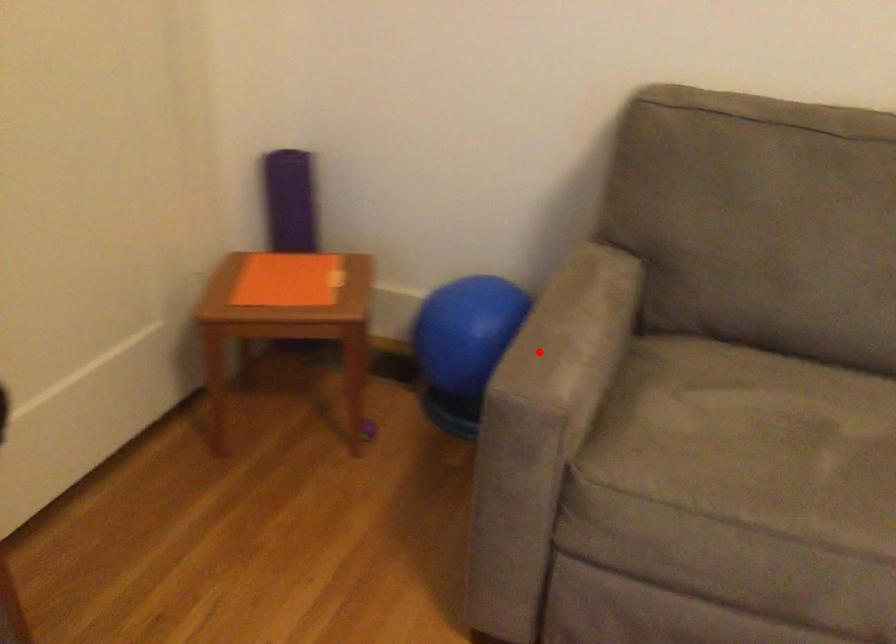
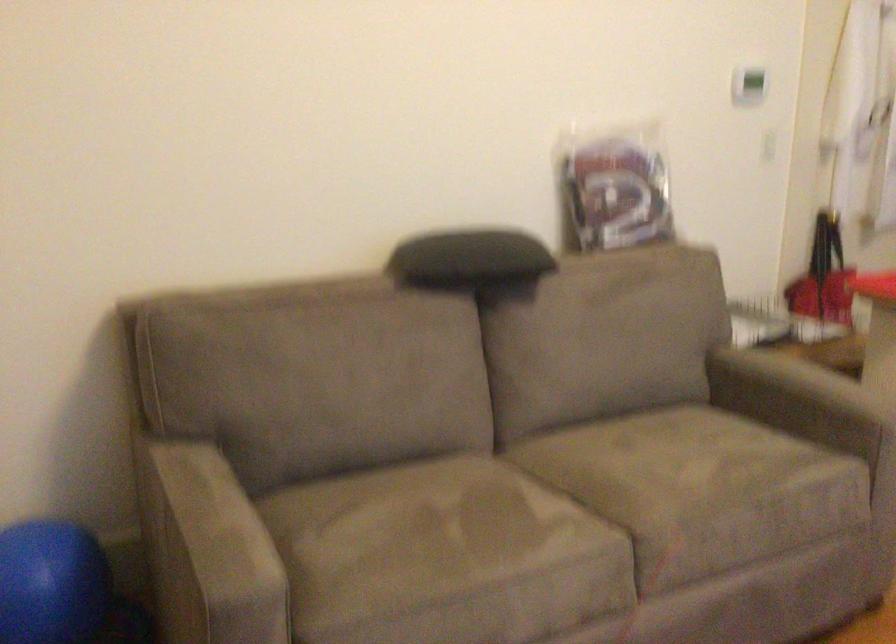
In the second image, find the point that corresponds to the highlighted location in the first image.

(209, 550)